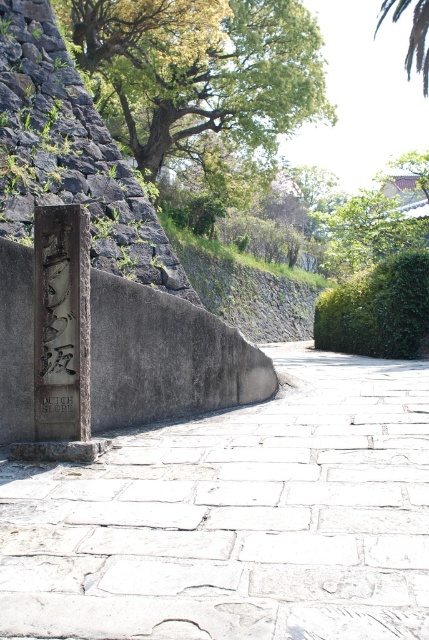
Question: Which object appears closest to the camera in this image?

Choices:
 (A) green leafy tree at upper left
 (B) black stone writing at center
 (C) white stone pavement at center

Answer: (C)

Question: Is stone plaque at center closer to camera compared to green leafy tree at upper center?

Choices:
 (A) no
 (B) yes

Answer: (B)

Question: Among these points, which one is farthest from the camera?

Choices:
 (A) [62, 412]
 (B) [293, 29]
 (C) [129, 484]

Answer: (B)

Question: Does green leafy tree at upper left appear over green leafy tree at upper center?

Choices:
 (A) no
 (B) yes

Answer: (A)

Question: Is green leafy tree at upper left smaller than stone plaque at center?

Choices:
 (A) no
 (B) yes

Answer: (A)

Question: Which point is closer to the camera?

Choices:
 (A) black stone writing at center
 (B) green leafy tree at upper center

Answer: (A)